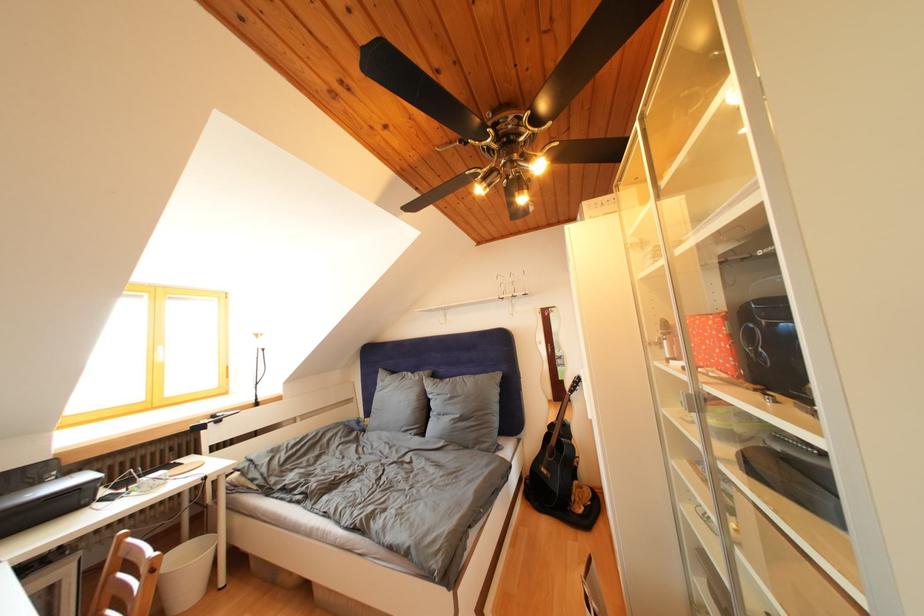
Image resolution: width=924 pixels, height=616 pixels. Describe the element at coordinates (46, 501) in the screenshot. I see `the black guitar case` at that location.